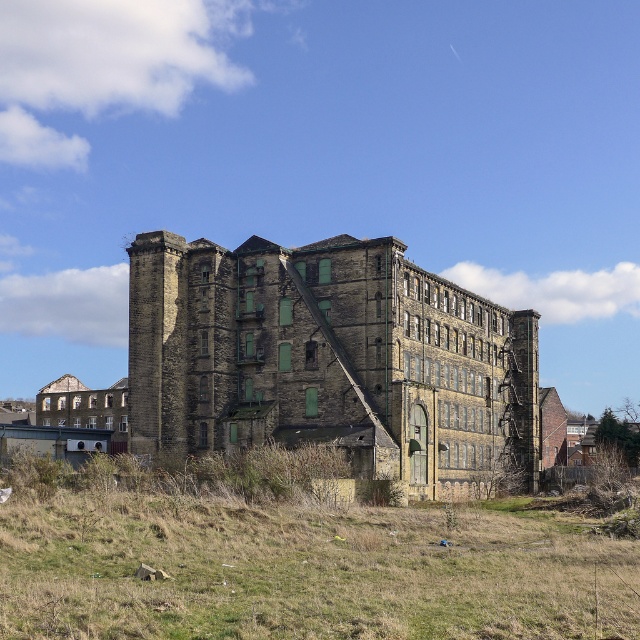
Question: Which of the following is the closest to the observer?

Choices:
 (A) (337, 442)
 (B) (189, 620)

Answer: (B)

Question: Does green grass at lower center appear under brown stone building at center?

Choices:
 (A) no
 (B) yes

Answer: (B)

Question: Does green grass at lower center appear on the right side of brown stone building at center?

Choices:
 (A) no
 (B) yes

Answer: (A)

Question: Which point is farther to the camera?

Choices:
 (A) (262, 531)
 (B) (262, 340)

Answer: (B)

Question: Among these objects, which one is farthest from the camera?

Choices:
 (A) green grass at lower center
 (B) brown stone building at center

Answer: (B)

Question: Can you confirm if green grass at lower center is bigger than brown stone building at center?

Choices:
 (A) yes
 (B) no

Answer: (B)